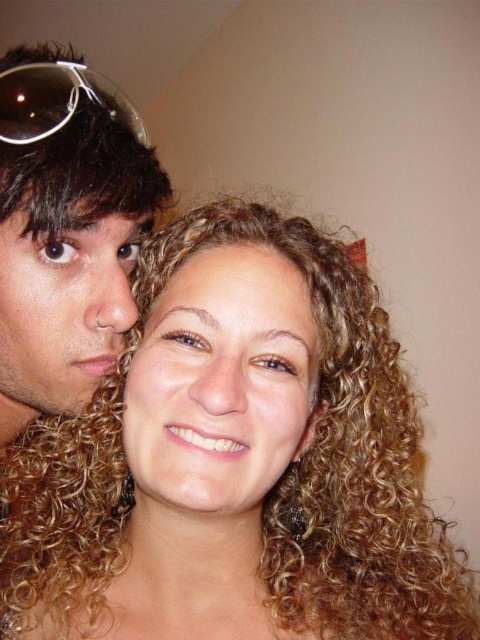
You are a photographer trying to capture the perfect shot of the two people in the scene. You notice a golden curly hair at center at point (222, 381). Where should you focus your camera to ensure the golden curly hair at center is in sharp focus?

You should focus your camera precisely at point (222, 381) where the golden curly hair at center is located to ensure it is in sharp focus.

You are taking a photo of two people standing in front of a beige wall. You notice two points in the image labeled as point (363, 346) and point (303, 323). Which point is closer to the camera?

Point (363, 346) is further to the camera than point (303, 323), so the point closer to the camera is point (303, 323).

You are a photographer trying to adjust the lighting for a portrait. You notice the golden curly hair at center and the transparent plastic sunglasses at upper left. Which object is positioned lower in the frame?

The golden curly hair at center is positioned below the transparent plastic sunglasses at upper left, so it is lower in the frame.